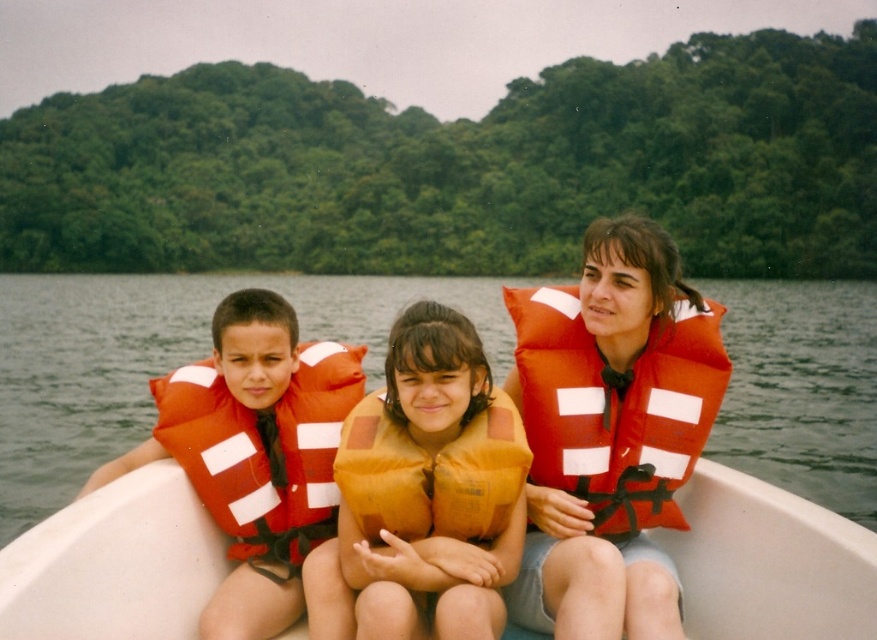
Question: Which point appears farthest from the camera in this image?

Choices:
 (A) (765, 314)
 (B) (255, 426)
 (C) (290, 436)

Answer: (A)

Question: Is matte orange life vest at center wider than orange fabric life vest at center?

Choices:
 (A) no
 (B) yes

Answer: (B)

Question: Considering the real-world distances, which object is closest to the orange fabric life vest at center?

Choices:
 (A) orange fabric life jacket at left
 (B) orange fabric life jacket at center
 (C) orange soft life vest at center
 (D) matte orange life vest at left

Answer: (C)

Question: Can you confirm if matte orange life vest at center is bigger than matte orange life vest at left?

Choices:
 (A) no
 (B) yes

Answer: (B)

Question: Which point is farther from the camera taking this photo?

Choices:
 (A) (560, 481)
 (B) (248, 413)
 (C) (772, 534)
 (D) (425, 500)

Answer: (B)

Question: Can you confirm if white plastic boat at center is positioned to the left of orange soft life vest at center?

Choices:
 (A) no
 (B) yes

Answer: (B)